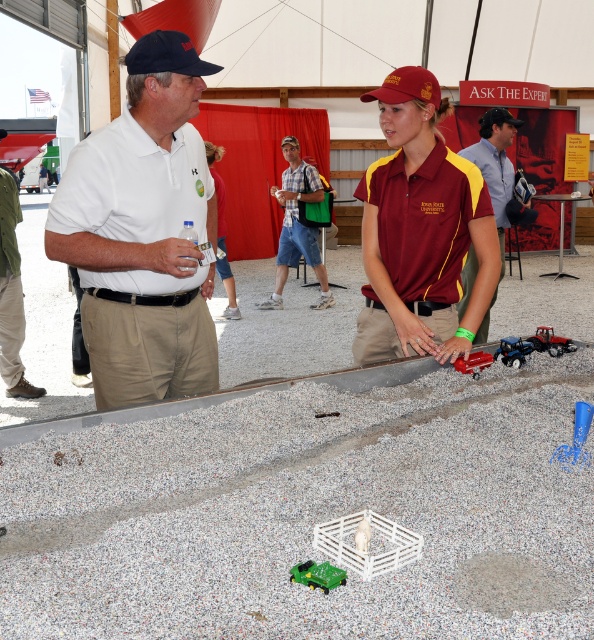
Please provide the 2D coordinates of the matte white shirt at center in the image. The answer should be in the format of coordinates in parentheses, like so, for example, if the coordinates were at point 0.258, 0.835, you would write the answer as follows. Answer the question with the exact coordinates given in the Objects Description. Answer in the following format, using the exact wording and coordinates from the Objects Description. The answer should be concise and only contain the coordinates in the box

The coordinates of the matte white shirt at center are at point (495, 164).

You are standing at the ASK THE EXPERT booth and see two points marked on the floor. The first point is labeled as point (21, 340) and the second is labeled as point (187, 40). If you are facing the booth, which point is closer to you?

Point (187, 40) is closer to you because it is in front of point (21, 340).

You are standing in the booth and want to hand a brochure to the taller object between the matte white shirt at center and the navy blue fabric baseball cap at upper left. Which one should you approach?

The matte white shirt at center is taller than the navy blue fabric baseball cap at upper left, so you should approach the matte white shirt at center to hand the brochure.